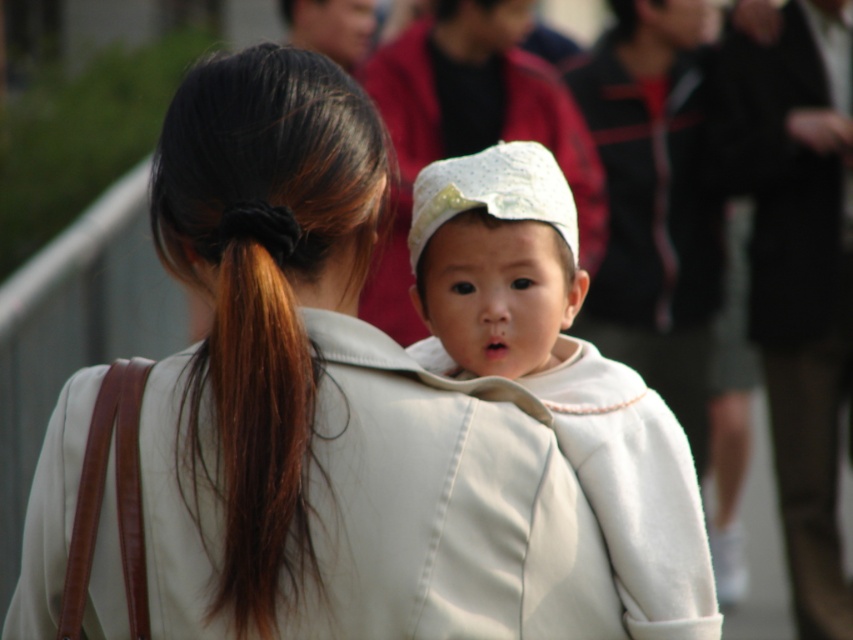
You are a photographer trying to capture the baby on the woman back. You notice the white leather jacket at center and the brown silky hair at upper left in your viewfinder. Which object should you avoid to ensure the baby is the main focus?

The white leather jacket at center is bigger than brown silky hair at upper left, so you should avoid the white leather jacket at center to ensure the baby is the main focus.

You are a photographer trying to capture a closeup of the white soft hat at center. You notice the white leather jacket at center is blocking your view. Can you move the jacket to the right to get a clear shot?

The white leather jacket at center is to the left of white soft hat at center, so moving the jacket to the right would allow it to no longer block the view of the white soft hat at center.